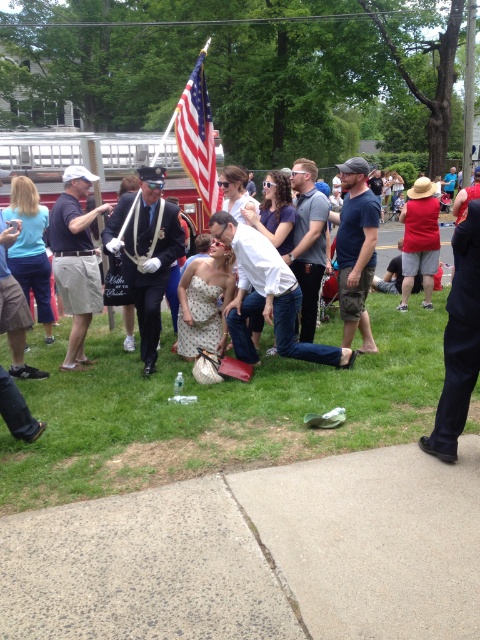
Question: Considering the real-world distances, which object is closest to the gray cotton t-shirt at center?

Choices:
 (A) dark blue jeans at right
 (B) matte black uniform at left

Answer: (B)

Question: Is green grass at center to the left of gray cotton t-shirt at center from the viewer's perspective?

Choices:
 (A) yes
 (B) no

Answer: (A)

Question: Does dark blue jeans at right have a smaller size compared to matte black uniform at left?

Choices:
 (A) no
 (B) yes

Answer: (B)

Question: Among these points, which one is nearest to the camera?

Choices:
 (A) (313, 163)
 (B) (254, 294)
 (C) (354, 369)

Answer: (C)

Question: Which of these objects is positioned farthest from the shiny black suit at center?

Choices:
 (A) american flag at center
 (B) gray cotton t-shirt at center
 (C) matte black uniform at left
 (D) dark blue t-shirt at center

Answer: (A)

Question: Is dark blue t-shirt at center closer to the viewer compared to american flag at center?

Choices:
 (A) no
 (B) yes

Answer: (B)